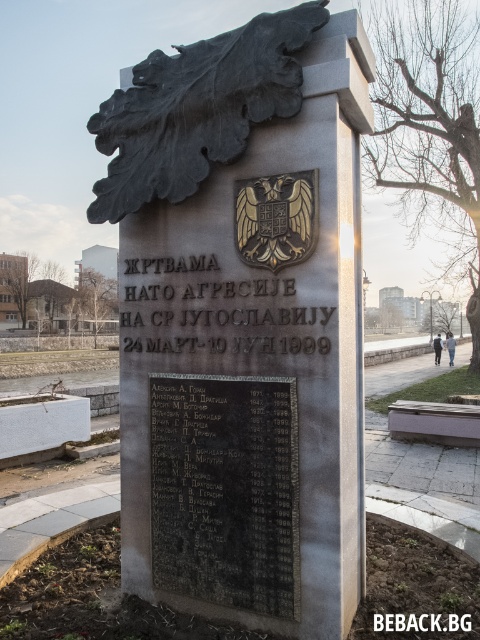
You are a park maintenance worker who needs to place a new decorative pot in the landscaped area around the black granite monument at center and the black stone plaque at center. To ensure visibility, you want the pot to be placed where it won not block the view of either object. Considering their sizes, which object should the pot be placed closer to?

The black granite monument at center is larger in size than the black stone plaque at center, so placing the pot closer to the black stone plaque at center would minimize the risk of blocking the view of the larger monument.

You are a photographer standing in front of the black granite monument at center and the matte black jacket at center. You want to capture a photo where both objects are visible in the frame. Since the monument is taller, which object should you position closer to the camera to ensure both are fully visible?

The black granite monument at center is taller than the matte black jacket at center. To ensure both are fully visible in the photo, position the matte black jacket at center closer to the camera so that its size in the frame matches the monument.

Consider the image. You are standing in front of the black granite monument at center and the matte black jacket at center. Which object is closer to you?

The black granite monument at center is closer to the viewer than the matte black jacket at center.